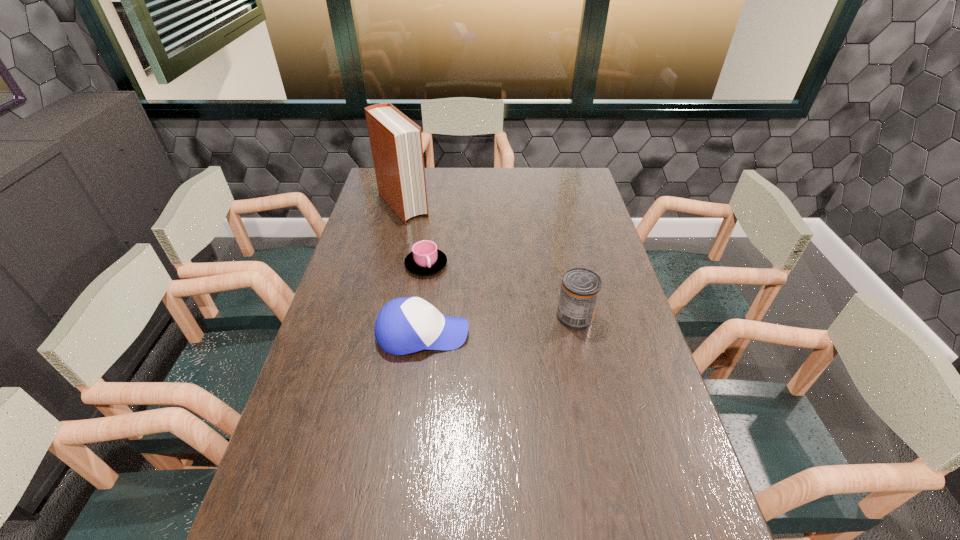
Image resolution: width=960 pixels, height=540 pixels. Find the location of `vacant spot on the desktop that is between the baseball cap and the can and is positioned on the open cover of the tallest object`. vacant spot on the desktop that is between the baseball cap and the can and is positioned on the open cover of the tallest object is located at coordinates (511, 324).

Locate an element on the screen. The image size is (960, 540). free space on the desktop that is between the second shortest object and the can and is positioned on the side with the handle of the third nearest object is located at coordinates (483, 327).